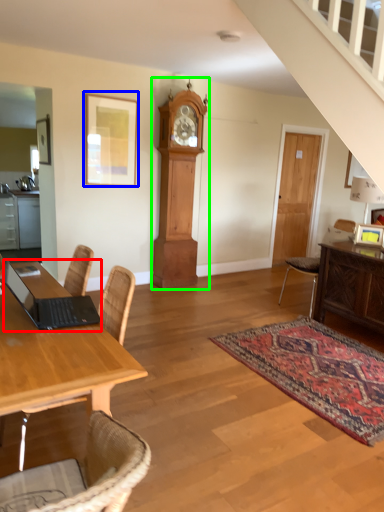
Question: Which is nearer to the laptop (highlighted by a red box)? picture frame (highlighted by a blue box) or clock (highlighted by a green box).

Choices:
 (A) picture frame
 (B) clock

Answer: (A)